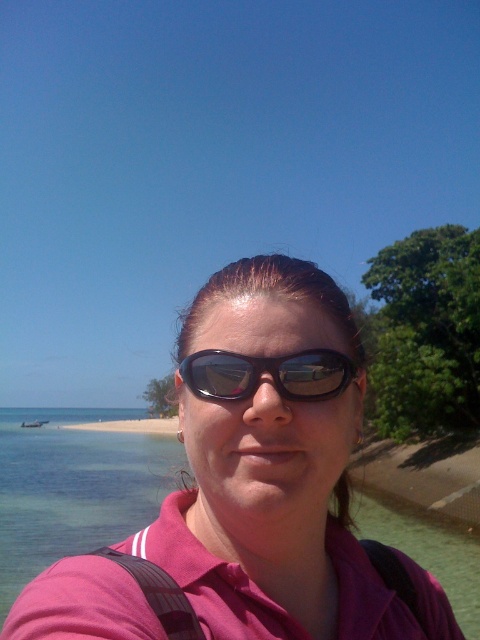
You are a photographer trying to capture the clear water at beach front and the sunglasses at center in the same frame. Based on their positions, which object would you adjust your camera angle to focus on first if you want to include both in the shot?

The clear water at beach front is positioned on the left side of sunglasses at center, so you should adjust your camera angle to focus on the sunglasses at center first to ensure both objects are included in the frame.

You are a photographer trying to capture the perfect shot of the clear water at beach front and the sunglasses at center. Since you want to emphasize the size difference between them, which object should you zoom in on to make the smaller one appear larger?

The sunglasses at center is smaller than the clear water at beach front, so you should zoom in on the sunglasses at center to make it appear larger in the photo.